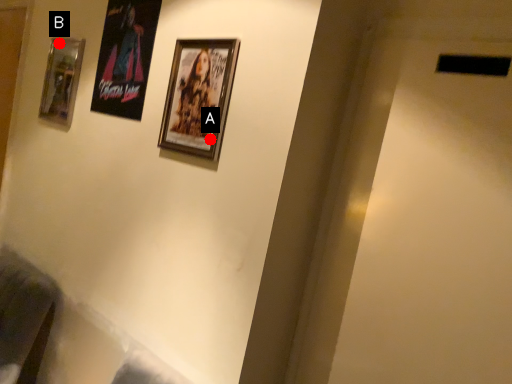
Question: Two points are circled on the image, labeled by A and B beside each circle. Among these points, which one is farthest from the camera?

Choices:
 (A) A is further
 (B) B is further

Answer: (B)